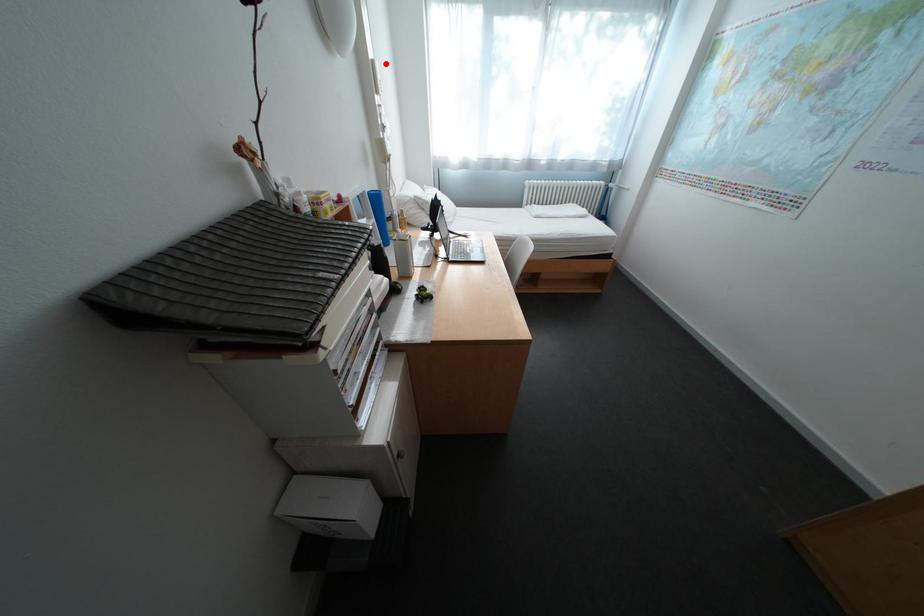
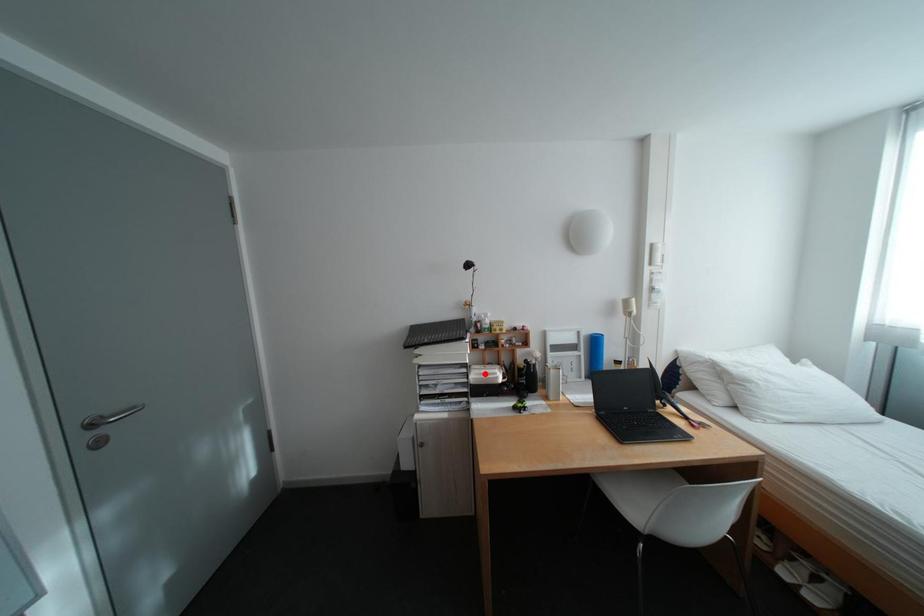
I am providing you with two images of the same scene from different viewpoints. A red point is marked on the first image and another point is marked on the second image. Is the red point in image1 aligned with the point shown in image2?

No